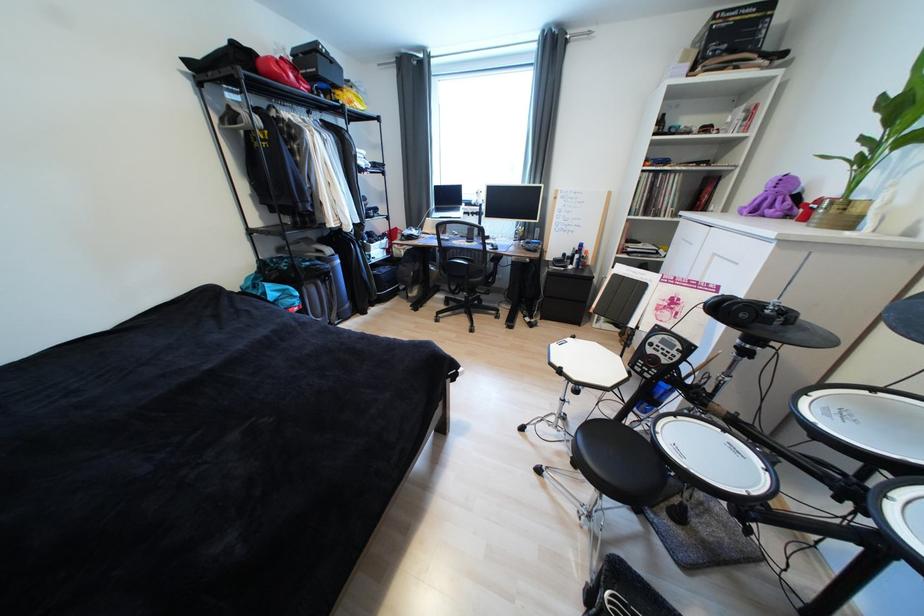
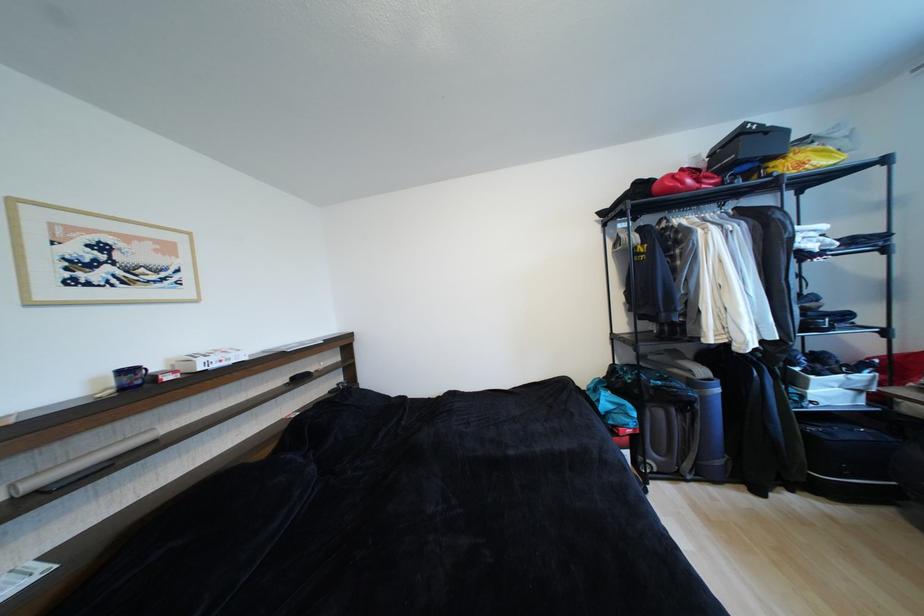
Where in the second image is the point corresponding to point 284,79 from the first image?

(676, 192)